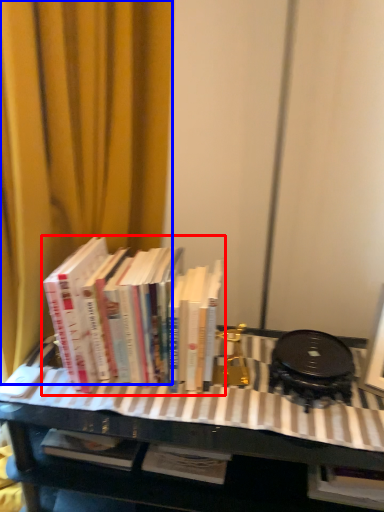
Question: Which point is further to the camera, book (highlighted by a red box) or curtain (highlighted by a blue box)?

Choices:
 (A) book
 (B) curtain

Answer: (A)